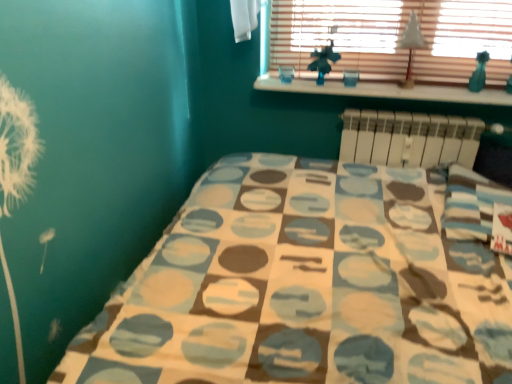
Question: From the image's perspective, relative to white wood at upper center, is white plastic radiator at upper right above or below?

Choices:
 (A) above
 (B) below

Answer: (B)

Question: From their relative heights in the image, would you say white plastic radiator at upper right is taller or shorter than white wood at upper center?

Choices:
 (A) short
 (B) tall

Answer: (B)

Question: Estimate the real-world distances between objects in this image. Which object is closer to the white wood at upper center?

Choices:
 (A) white plastic radiator at upper right
 (B) wooden blinds at upper center
 (C) white paper at upper center

Answer: (B)

Question: Which object is positioned closest to the white paper at upper center?

Choices:
 (A) wooden blinds at upper center
 (B) white plastic radiator at upper right
 (C) white wood at upper center

Answer: (A)